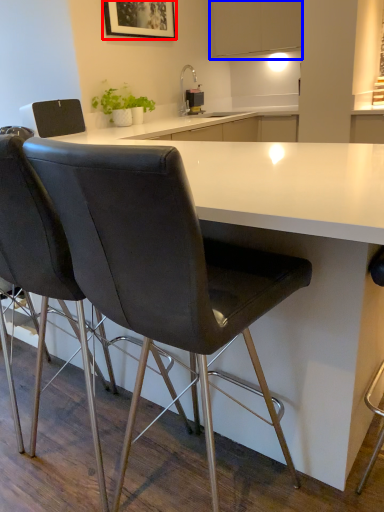
Question: Which object is further to the camera taking this photo, picture frame (highlighted by a red box) or cabinetry (highlighted by a blue box)?

Choices:
 (A) picture frame
 (B) cabinetry

Answer: (B)